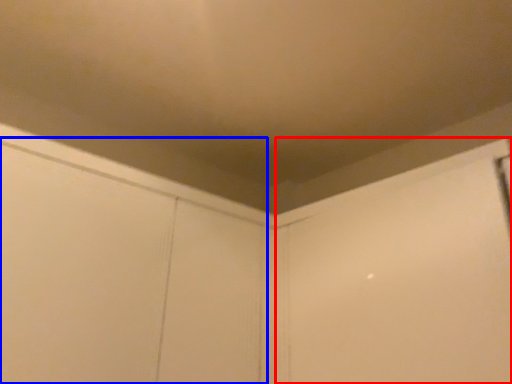
Question: Among these objects, which one is nearest to the camera, screen door (highlighted by a red box) or screen door (highlighted by a blue box)?

Choices:
 (A) screen door
 (B) screen door

Answer: (B)